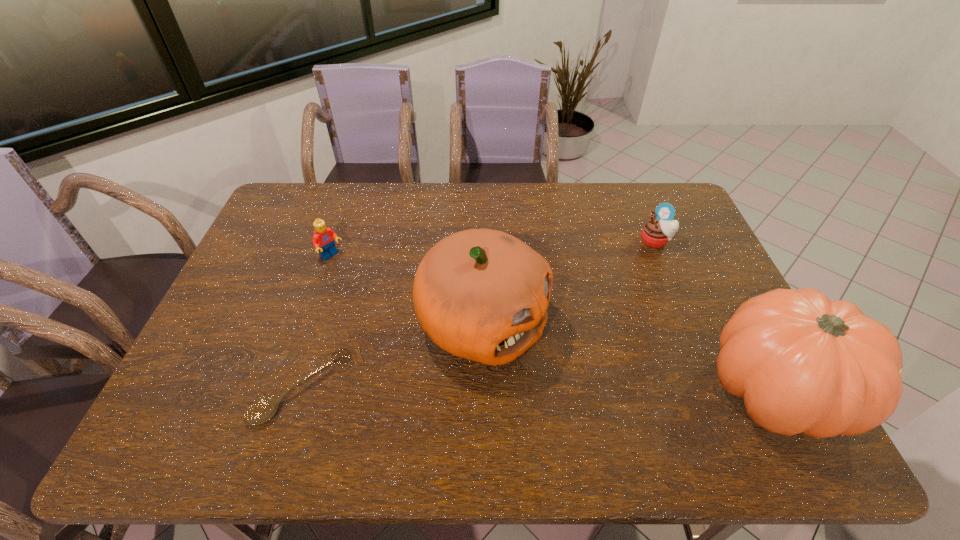
The image size is (960, 540). Identify the location of free space on the desktop that is between the shortest object and the right pumpkin and is positioned on the face of the Lego. (483, 389).

The image size is (960, 540). Identify the location of vacant space on the desktop that is between the ladle and the right pumpkin and is positioned on the face of the left pumpkin. (608, 389).

The height and width of the screenshot is (540, 960). Identify the location of free space on the desktop that is between the ladle and the right pumpkin and is positioned on the front-facing side of the muffin. (530, 389).